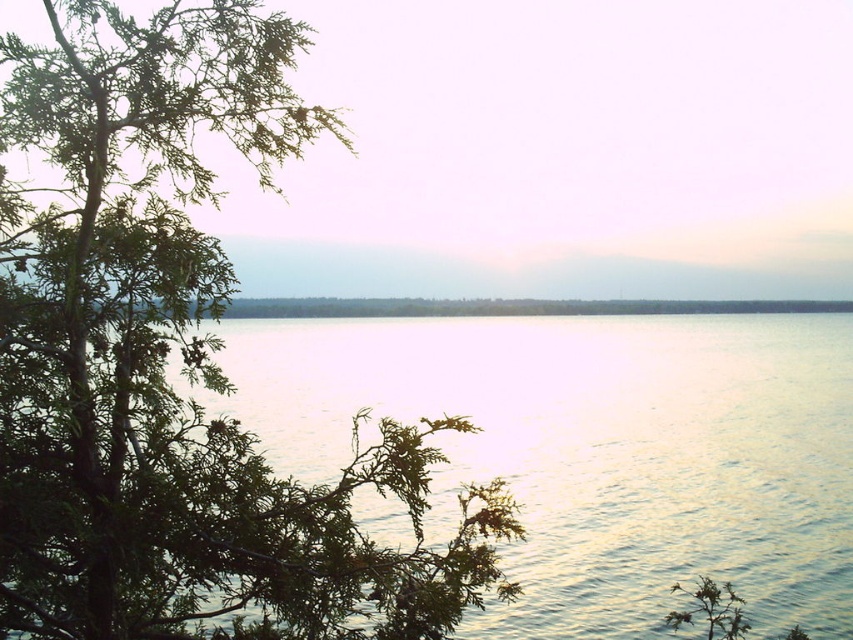
Between green textured leaves at left and glistening silver water at center, which one has less height?

Standing shorter between the two is glistening silver water at center.

This screenshot has width=853, height=640. Find the location of `green textured leaves at left`. green textured leaves at left is located at coordinates point(183,364).

Does point (173, 429) come closer to viewer compared to point (618, 316)?

That is True.

Where is `green textured leaves at left`? The height and width of the screenshot is (640, 853). green textured leaves at left is located at coordinates (183, 364).